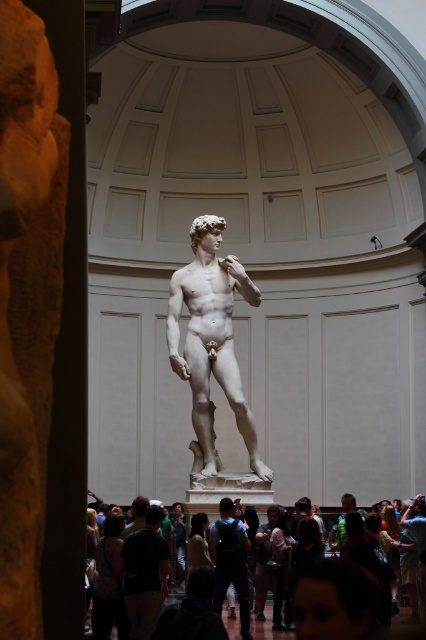
Can you confirm if black fabric shirt at center is thinner than matte gray statue at center?

Incorrect, black fabric shirt at center's width is not less than matte gray statue at center's.

Which of these two, black fabric shirt at center or matte gray statue at center, stands shorter?

black fabric shirt at center is shorter.

The width and height of the screenshot is (426, 640). Identify the location of black fabric shirt at center. (144, 573).

Can you confirm if white marble statue at center is bigger than matte gray crowd at center?

Incorrect, white marble statue at center is not larger than matte gray crowd at center.

From the picture: Can you confirm if white marble statue at center is smaller than matte gray crowd at center?

Correct, white marble statue at center occupies less space than matte gray crowd at center.

Does point (268, 481) lie behind point (400, 630)?

Yes.

Image resolution: width=426 pixels, height=640 pixels. Identify the location of white marble statue at center. (212, 337).

Can you confirm if matte gray statue at center is positioned below matte gray crowd at center?

No, matte gray statue at center is not below matte gray crowd at center.

From the picture: Can you confirm if matte gray statue at center is positioned above matte gray crowd at center?

Yes.

Does point (222, 577) come behind point (261, 628)?

No, (222, 577) is in front of (261, 628).

Image resolution: width=426 pixels, height=640 pixels. In order to click on matte gray statue at center in this screenshot , I will do `click(230, 561)`.